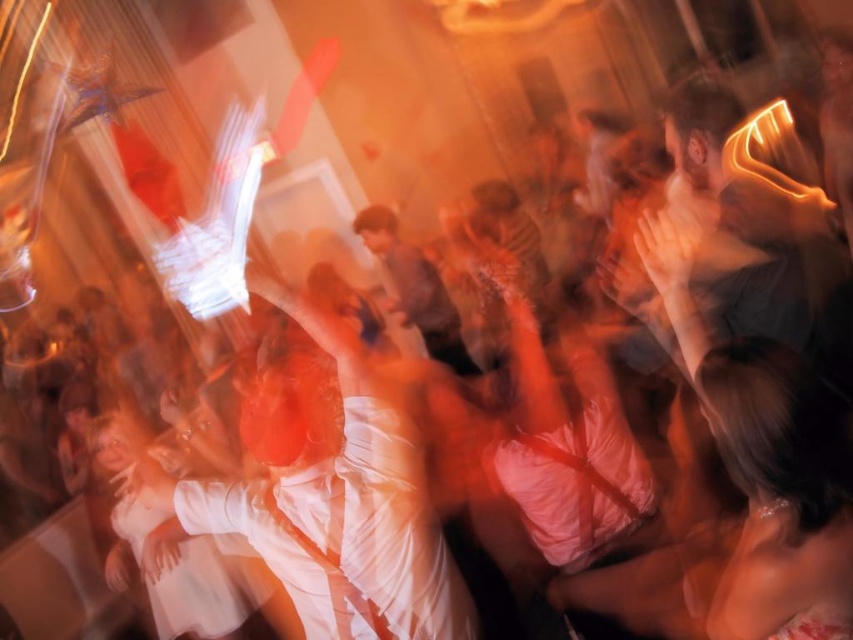
Question: Can you confirm if white satin dress at center is positioned above matte brown shirt at center?

Choices:
 (A) no
 (B) yes

Answer: (A)

Question: Can you confirm if white satin dress at center is smaller than matte brown shirt at center?

Choices:
 (A) yes
 (B) no

Answer: (A)

Question: Observing the image, what is the correct spatial positioning of white satin dress at center in reference to matte brown shirt at center?

Choices:
 (A) below
 (B) above

Answer: (A)

Question: Which of the following is the closest to the observer?

Choices:
 (A) (312, 412)
 (B) (410, 250)

Answer: (A)